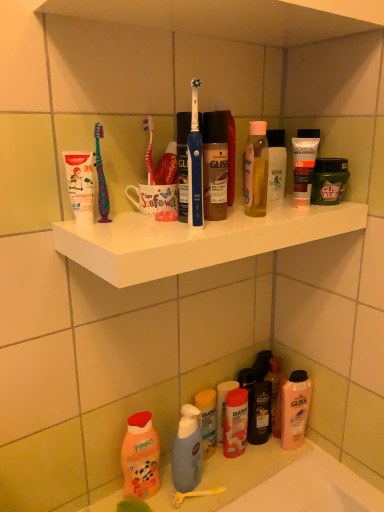
Question: Is the position of translucent plastic bottle at lower center, which is the 4th toiletry from right to left, less distant than that of matte orange lotion at lower center, which is the 3th toiletry in right-to-left order?

Choices:
 (A) yes
 (B) no

Answer: (B)

Question: Considering the relative sizes of translucent plastic bottle at lower center, which appears as the 4th toiletry when viewed from the top, and matte orange lotion at lower center, which is the fifth toiletry from top to bottom, in the image provided, is translucent plastic bottle at lower center, which appears as the 4th toiletry when viewed from the top, shorter than matte orange lotion at lower center, which is the fifth toiletry from top to bottom,?

Choices:
 (A) yes
 (B) no

Answer: (B)

Question: Considering the relative positions of translucent plastic bottle at lower center, which is the 4th toiletry from right to left, and matte orange lotion at lower center, which is the fifth toiletry from top to bottom, in the image provided, is translucent plastic bottle at lower center, which is the 4th toiletry from right to left, to the left of matte orange lotion at lower center, which is the fifth toiletry from top to bottom, from the viewer's perspective?

Choices:
 (A) no
 (B) yes

Answer: (B)

Question: Is translucent plastic bottle at lower center, which appears as the 4th toiletry when viewed from the top, far from matte orange lotion at lower center, which is the fifth toiletry from top to bottom?

Choices:
 (A) yes
 (B) no

Answer: (B)

Question: Is matte orange lotion at lower center, the second toiletry in the bottom-to-top sequence, located within translucent plastic bottle at lower center, which is the 4th toiletry from right to left?

Choices:
 (A) yes
 (B) no

Answer: (B)

Question: Is translucent plastic bottle at lower center, which appears as the 4th toiletry when viewed from the top, smaller than matte orange lotion at lower center, the second toiletry in the bottom-to-top sequence?

Choices:
 (A) no
 (B) yes

Answer: (B)

Question: Can you confirm if blue plastic toothbrush at center is taller than translucent plastic pump bottle at lower center, acting as the second toiletry starting from the left?

Choices:
 (A) no
 (B) yes

Answer: (B)

Question: Is blue plastic toothbrush at center positioned in front of translucent plastic pump bottle at lower center, acting as the fifth toiletry starting from the right?

Choices:
 (A) no
 (B) yes

Answer: (B)

Question: Is blue plastic toothbrush at center not within translucent plastic pump bottle at lower center, acting as the fifth toiletry starting from the right?

Choices:
 (A) no
 (B) yes

Answer: (B)

Question: Does blue plastic toothbrush at center have a lesser height compared to translucent plastic pump bottle at lower center, which is counted as the 6th toiletry, starting from the top?

Choices:
 (A) no
 (B) yes

Answer: (A)

Question: Is blue plastic toothbrush at center next to translucent plastic pump bottle at lower center, acting as the fifth toiletry starting from the right, and touching it?

Choices:
 (A) no
 (B) yes

Answer: (A)

Question: Does blue plastic toothbrush at center have a smaller size compared to translucent plastic pump bottle at lower center, the 1th toiletry when ordered from bottom to top?

Choices:
 (A) yes
 (B) no

Answer: (A)

Question: From the image's perspective, would you say pink matte shampoo at lower right, acting as the 2th cleaning product starting from the left, is shown under white matte shelf at upper center?

Choices:
 (A) no
 (B) yes

Answer: (B)